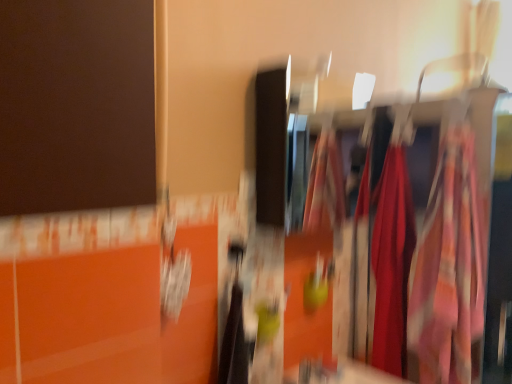
Measure the distance between silky fabric dress at right and camera.

silky fabric dress at right and camera are 1.57 meters apart from each other.

The width and height of the screenshot is (512, 384). I want to click on floral fabric dress at right, the 1th clothing when ordered from front to back, so (450, 269).

Does floral fabric dress at right, the 2th clothing in the back-to-front sequence, have a greater width compared to silky red fabric at center, positioned as the second clothing in front-to-back order?

Yes, floral fabric dress at right, the 2th clothing in the back-to-front sequence, is wider than silky red fabric at center, positioned as the second clothing in front-to-back order.

Does floral fabric dress at right, the 1th clothing when ordered from front to back, contain silky red fabric at center, positioned as the second clothing in front-to-back order?

Definitely not — silky red fabric at center, positioned as the second clothing in front-to-back order, is not inside floral fabric dress at right, the 1th clothing when ordered from front to back.

Does point (468, 364) appear closer or farther from the camera than point (388, 202)?

Point (468, 364) appears to be closer to the viewer than point (388, 202).

Is floral fabric dress at right, the 1th clothing when ordered from front to back, touching silky red fabric at center, marked as the 1th clothing in a back-to-front arrangement?

No, floral fabric dress at right, the 1th clothing when ordered from front to back, is not in contact with silky red fabric at center, marked as the 1th clothing in a back-to-front arrangement.

Can you tell me how much silky red fabric at center, positioned as the second clothing in front-to-back order, and floral fabric dress at right, the 2th clothing in the back-to-front sequence, differ in facing direction?

The angular difference between silky red fabric at center, positioned as the second clothing in front-to-back order, and floral fabric dress at right, the 2th clothing in the back-to-front sequence, is 6.32e-05 degrees.

Between silky red fabric at center, positioned as the second clothing in front-to-back order, and floral fabric dress at right, the 1th clothing when ordered from front to back, which one is positioned behind?

silky red fabric at center, positioned as the second clothing in front-to-back order, is behind.

Is silky red fabric at center, positioned as the second clothing in front-to-back order, at the left side of floral fabric dress at right, the 1th clothing when ordered from front to back?

Indeed, silky red fabric at center, positioned as the second clothing in front-to-back order, is positioned on the left side of floral fabric dress at right, the 1th clothing when ordered from front to back.

Where is `clothing located behind the floral fabric dress at right, the 1th clothing when ordered from front to back`? Image resolution: width=512 pixels, height=384 pixels. clothing located behind the floral fabric dress at right, the 1th clothing when ordered from front to back is located at coordinates (392, 262).

Does silky red fabric at center, positioned as the second clothing in front-to-back order, have a greater width compared to silky fabric dress at right?

No.

Who is smaller, silky red fabric at center, positioned as the second clothing in front-to-back order, or silky fabric dress at right?

silky red fabric at center, positioned as the second clothing in front-to-back order, is smaller.

From a real-world perspective, is silky red fabric at center, positioned as the second clothing in front-to-back order, positioned over silky fabric dress at right based on gravity?

Yes, from a real-world perspective, silky red fabric at center, positioned as the second clothing in front-to-back order, is above silky fabric dress at right.

Who is more distant, silky fabric dress at right or floral fabric dress at right, the 2th clothing in the back-to-front sequence?

Positioned behind is floral fabric dress at right, the 2th clothing in the back-to-front sequence.

Is silky fabric dress at right facing towards floral fabric dress at right, the 1th clothing when ordered from front to back?

No, silky fabric dress at right is not oriented towards floral fabric dress at right, the 1th clothing when ordered from front to back.

Consider the image. From a real-world perspective, is silky fabric dress at right under floral fabric dress at right, the 1th clothing when ordered from front to back?

Indeed, from a real-world perspective, silky fabric dress at right is positioned beneath floral fabric dress at right, the 1th clothing when ordered from front to back.

Does silky fabric dress at right have a greater width compared to floral fabric dress at right, the 1th clothing when ordered from front to back?

Yes.

Based on the photo, from the image's perspective, would you say silky fabric dress at right is shown under silky red fabric at center, positioned as the second clothing in front-to-back order?

Yes, from the image's perspective, silky fabric dress at right is below silky red fabric at center, positioned as the second clothing in front-to-back order.

Which object is more forward, silky fabric dress at right or silky red fabric at center, marked as the 1th clothing in a back-to-front arrangement?

Positioned in front is silky fabric dress at right.

Is silky fabric dress at right far away from silky red fabric at center, positioned as the second clothing in front-to-back order?

silky fabric dress at right is actually quite close to silky red fabric at center, positioned as the second clothing in front-to-back order.

Does floral fabric dress at right, the 2th clothing in the back-to-front sequence, turn towards silky fabric dress at right?

No, floral fabric dress at right, the 2th clothing in the back-to-front sequence, is not turned towards silky fabric dress at right.

Is floral fabric dress at right, the 1th clothing when ordered from front to back, behind silky fabric dress at right?

Yes, floral fabric dress at right, the 1th clothing when ordered from front to back, is further from the viewer.

Which is less distant, (438, 315) or (342, 201)?

Point (438, 315) appears to be closer to the viewer than point (342, 201).

Which is more to the left, floral fabric dress at right, the 2th clothing in the back-to-front sequence, or silky fabric dress at right?

From the viewer's perspective, floral fabric dress at right, the 2th clothing in the back-to-front sequence, appears more on the left side.

Find the location of a particular element. This screenshot has height=384, width=512. clothing below the floral fabric dress at right, the 2th clothing in the back-to-front sequence (from the image's perspective) is located at coordinates (392, 262).

Where is `clothing above the silky red fabric at center, marked as the 1th clothing in a back-to-front arrangement (from a real-world perspective)`? clothing above the silky red fabric at center, marked as the 1th clothing in a back-to-front arrangement (from a real-world perspective) is located at coordinates (450, 269).

Considering their positions, is silky red fabric at center, positioned as the second clothing in front-to-back order, positioned closer to silky fabric dress at right than floral fabric dress at right, the 2th clothing in the back-to-front sequence?

floral fabric dress at right, the 2th clothing in the back-to-front sequence, is closer to silky fabric dress at right.

Looking at the image, which one is located further to floral fabric dress at right, the 1th clothing when ordered from front to back, silky fabric dress at right or silky red fabric at center, positioned as the second clothing in front-to-back order?

Based on the image, silky red fabric at center, positioned as the second clothing in front-to-back order, appears to be further to floral fabric dress at right, the 1th clothing when ordered from front to back.

Looking at the image, which one is located further to silky fabric dress at right, floral fabric dress at right, the 1th clothing when ordered from front to back, or silky red fabric at center, marked as the 1th clothing in a back-to-front arrangement?

silky red fabric at center, marked as the 1th clothing in a back-to-front arrangement, is further to silky fabric dress at right.

Looking at the image, which one is located further to silky red fabric at center, positioned as the second clothing in front-to-back order, silky fabric dress at right or floral fabric dress at right, the 2th clothing in the back-to-front sequence?

floral fabric dress at right, the 2th clothing in the back-to-front sequence, is further to silky red fabric at center, positioned as the second clothing in front-to-back order.

Looking at the image, which one is located closer to silky red fabric at center, positioned as the second clothing in front-to-back order, floral fabric dress at right, the 2th clothing in the back-to-front sequence, or silky fabric dress at right?

Among the two, silky fabric dress at right is located nearer to silky red fabric at center, positioned as the second clothing in front-to-back order.

Based on their spatial positions, is silky red fabric at center, marked as the 1th clothing in a back-to-front arrangement, or silky fabric dress at right further from floral fabric dress at right, the 2th clothing in the back-to-front sequence?

Among the two, silky red fabric at center, marked as the 1th clothing in a back-to-front arrangement, is located further to floral fabric dress at right, the 2th clothing in the back-to-front sequence.

Locate an element on the screen. The width and height of the screenshot is (512, 384). clothing situated between silky red fabric at center, positioned as the second clothing in front-to-back order, and silky fabric dress at right from left to right is located at coordinates (450, 269).